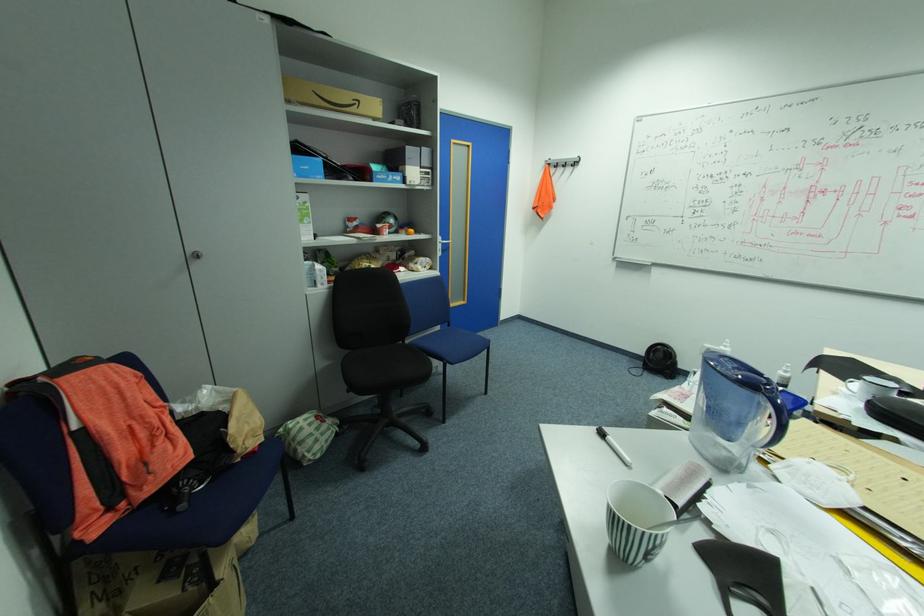
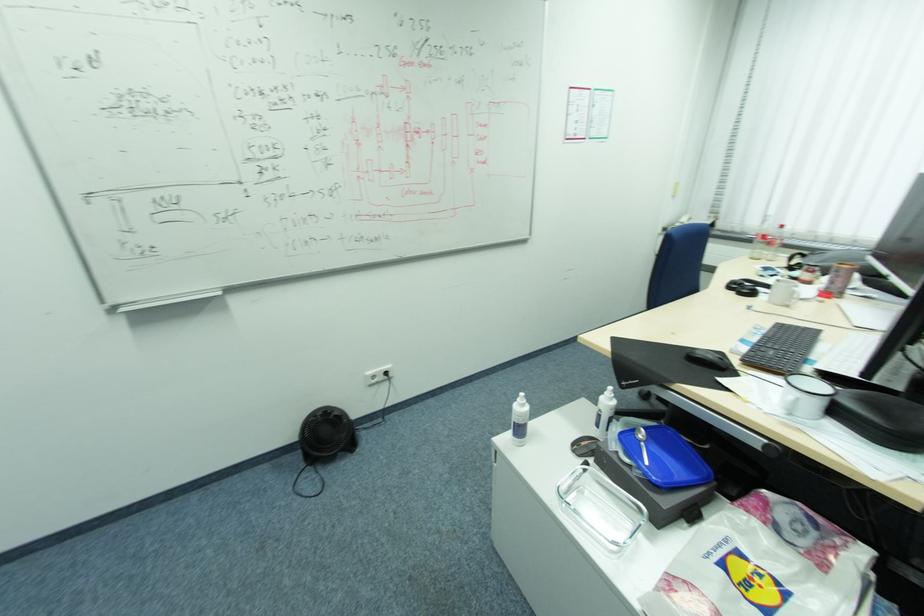
Find the pixel in the second image that matches point (648, 363) in the first image.

(304, 456)